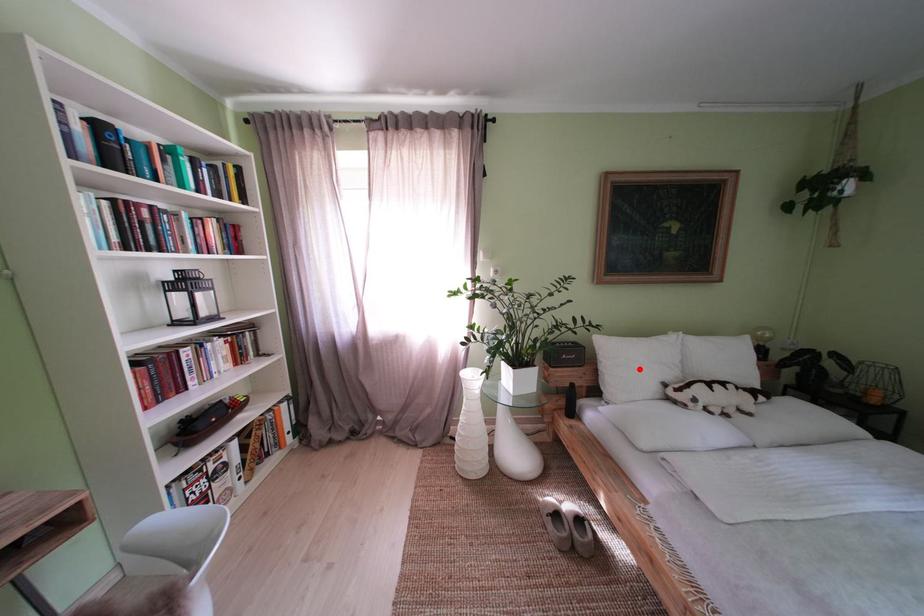
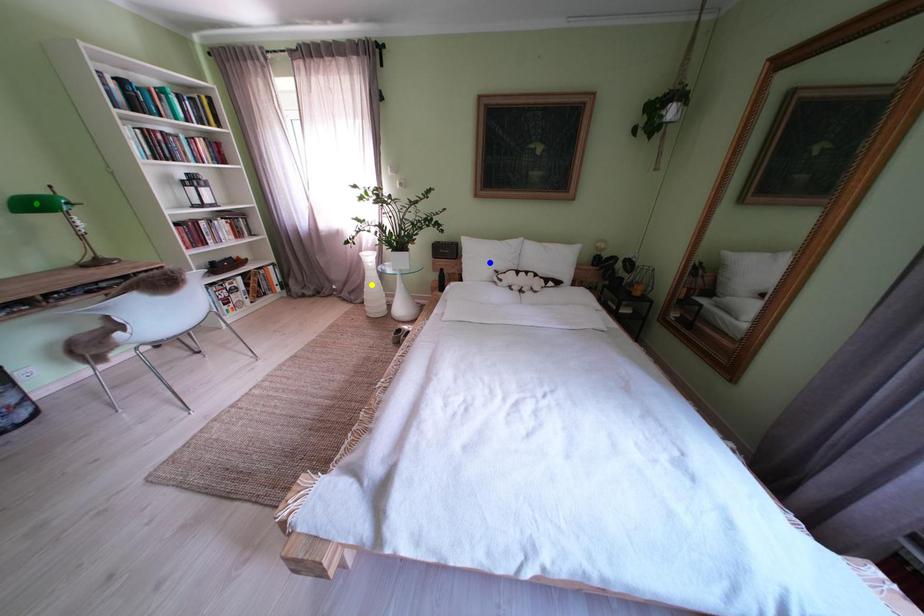
Question: I am providing you with two images of the same scene from different viewpoints. A red point is marked on the first image. You are given multiple points on the second image. Which point in image 2 is actually the same real-world point as the red point in image 1?

Choices:
 (A) green point
 (B) yellow point
 (C) blue point

Answer: (C)